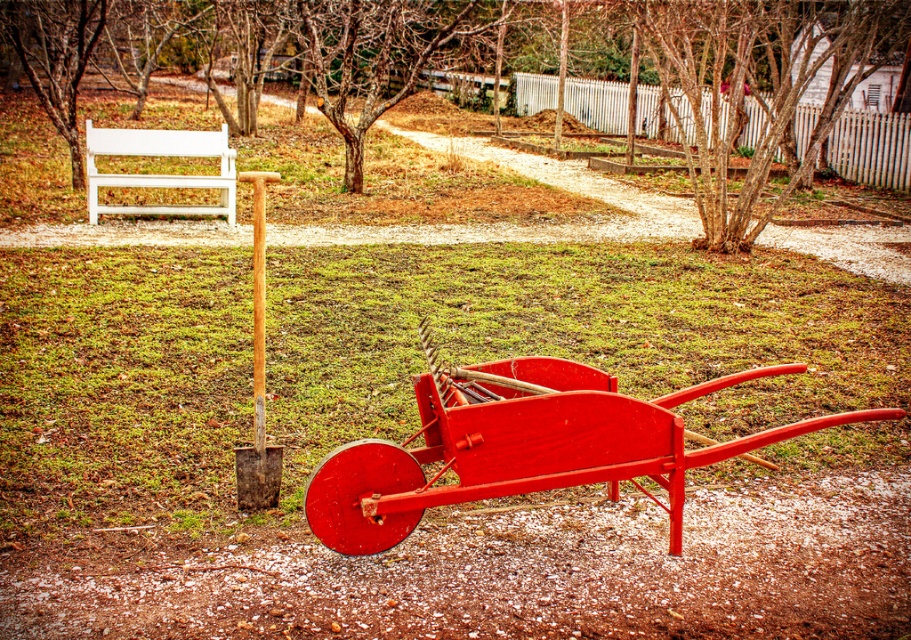
Question: Can you confirm if matte red wagon at center is bigger than brown textured tree at center?

Choices:
 (A) no
 (B) yes

Answer: (A)

Question: Does green grass at center appear under white painted wood bench at upper left?

Choices:
 (A) yes
 (B) no

Answer: (A)

Question: Is smooth bark tree at center thinner than white painted wood bench at upper left?

Choices:
 (A) yes
 (B) no

Answer: (B)

Question: Which of the following is the farthest from the observer?

Choices:
 (A) green grass at center
 (B) smooth bark tree at center

Answer: (B)

Question: Which point is closer to the camera?

Choices:
 (A) (360, 508)
 (B) (85, 124)

Answer: (A)

Question: Among these objects, which one is nearest to the camera?

Choices:
 (A) brown textured tree at center
 (B) green grass at center
 (C) matte red wagon at center

Answer: (C)